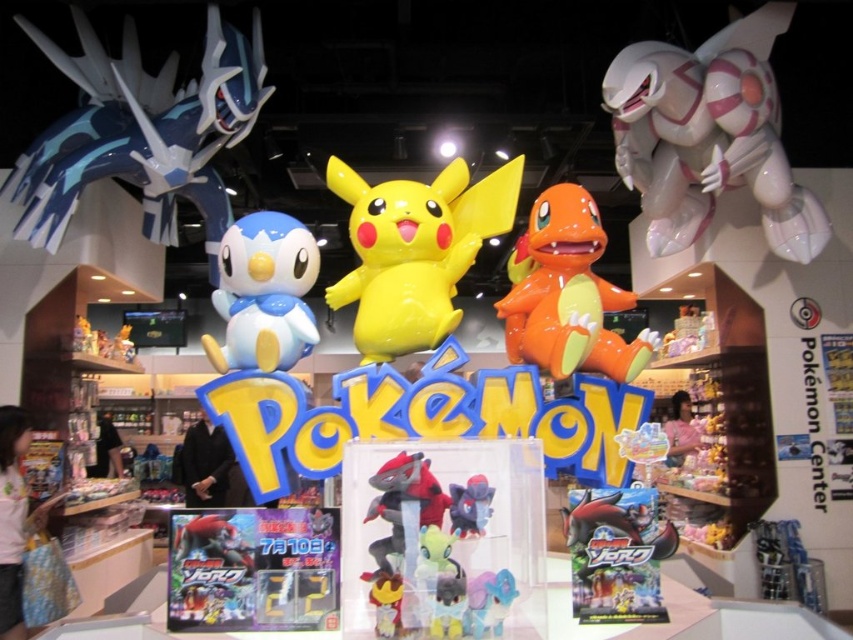
Question: Which point is closer to the camera?

Choices:
 (A) (250, 276)
 (B) (479, 497)
 (C) (152, 186)
 (D) (743, 134)

Answer: (B)

Question: Estimate the real-world distances between objects in this image. Which object is closer to the shiny plastic toy at center?

Choices:
 (A) yellow matte pikachu at center
 (B) shiny orange plastic charmander at center
 (C) white glossy robot at upper right

Answer: (B)

Question: In this image, where is shiny orange plastic charmander at center located relative to velvet plush toy at center?

Choices:
 (A) left
 (B) right

Answer: (B)

Question: Is velvet plush toy at center to the left of matte gray plush at center from the viewer's perspective?

Choices:
 (A) no
 (B) yes

Answer: (B)

Question: Is glossy plastic penguin at upper left bigger than shiny orange plastic charmander at center?

Choices:
 (A) yes
 (B) no

Answer: (A)

Question: Which object is the closest to the glossy plastic penguin at upper left?

Choices:
 (A) matte gray plush at center
 (B) shiny orange plastic charmander at center
 (C) matte blue plush at center

Answer: (C)